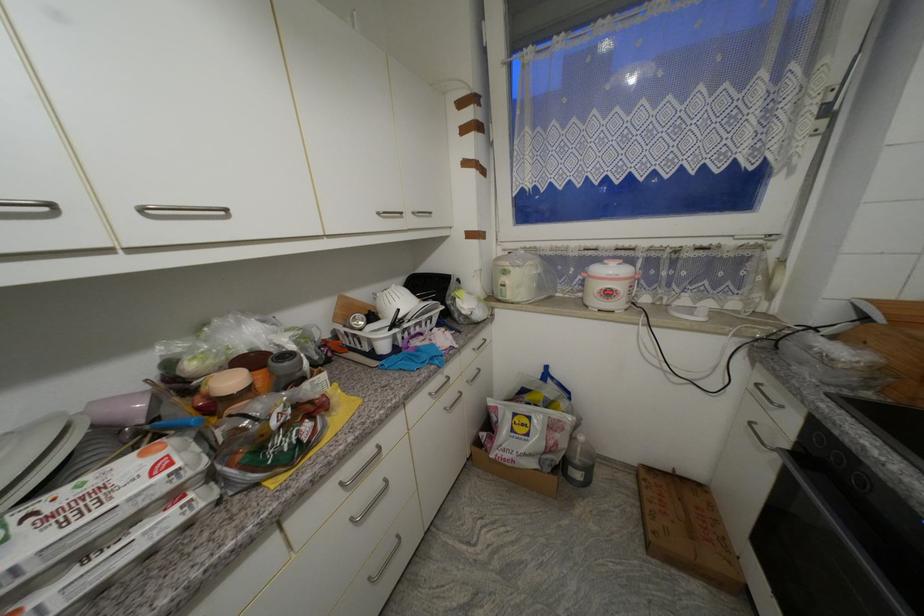
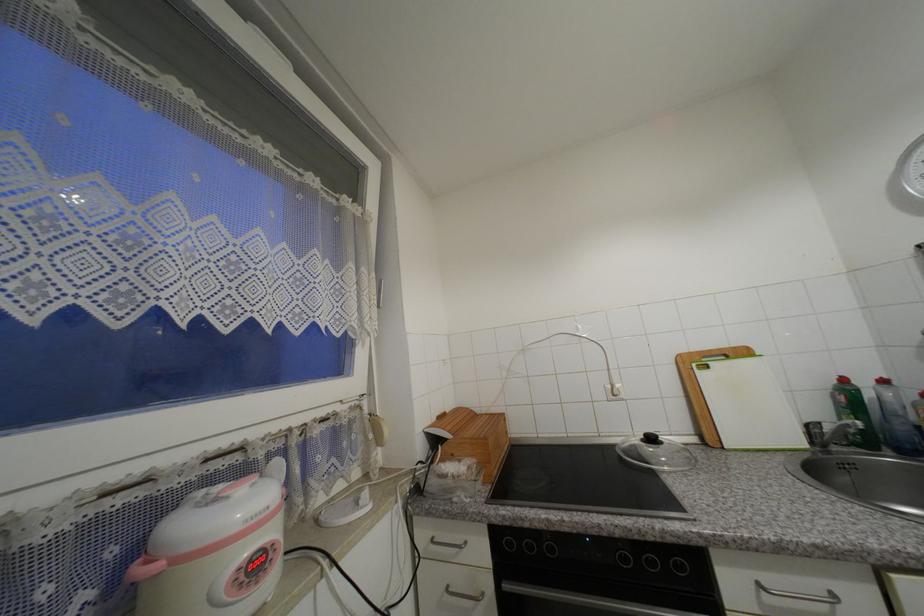
Question: The camera is either moving clockwise (left) or counter-clockwise (right) around the object. The first image is from the beginning of the video and the second image is from the end. Is the camera moving left or right when shooting the video?

Choices:
 (A) Left
 (B) Right

Answer: (A)